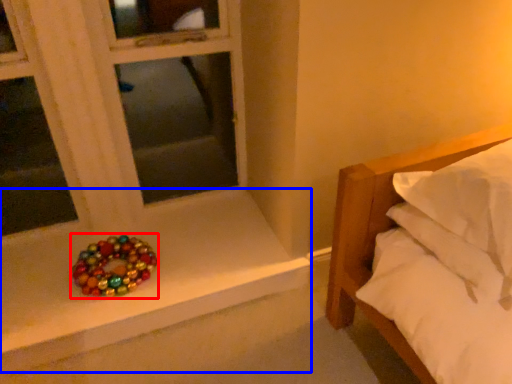
Question: Which point is further to the camera, glass bead (highlighted by a red box) or window sill (highlighted by a blue box)?

Choices:
 (A) glass bead
 (B) window sill

Answer: (A)